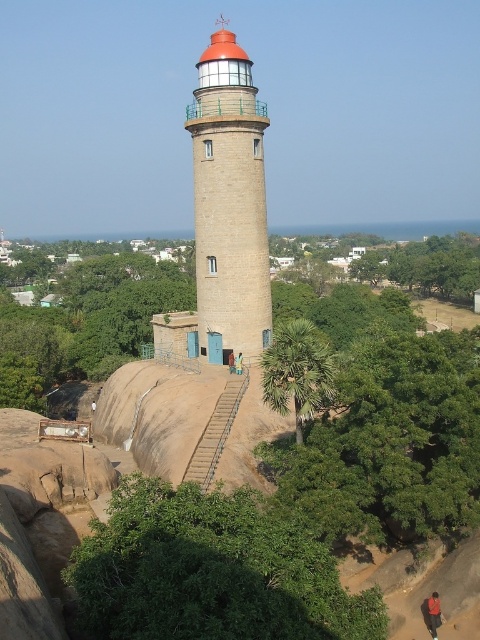
Question: Based on their relative distances, which object is farther from the brown fabric bag at center?

Choices:
 (A) metallic staircase at center
 (B) green leafy tree at lower center
 (C) green leafy palm at center
 (D) blue fabric person at center

Answer: (B)

Question: Is beige stone lighthouse at center smaller than blue fabric person at center?

Choices:
 (A) yes
 (B) no

Answer: (B)

Question: From the image, what is the correct spatial relationship of green leafy tree at lower center in relation to brown fabric bag at center?

Choices:
 (A) below
 (B) above

Answer: (A)

Question: Based on their relative distances, which object is nearer to the metallic staircase at center?

Choices:
 (A) green leafy palm at center
 (B) brown fabric bag at center
 (C) green leafy tree at lower center

Answer: (A)

Question: Which point appears farthest from the camera in this image?

Choices:
 (A) (240, 362)
 (B) (305, 346)

Answer: (A)

Question: Is beige stone lighthouse at center positioned behind brown fabric bag at center?

Choices:
 (A) no
 (B) yes

Answer: (A)